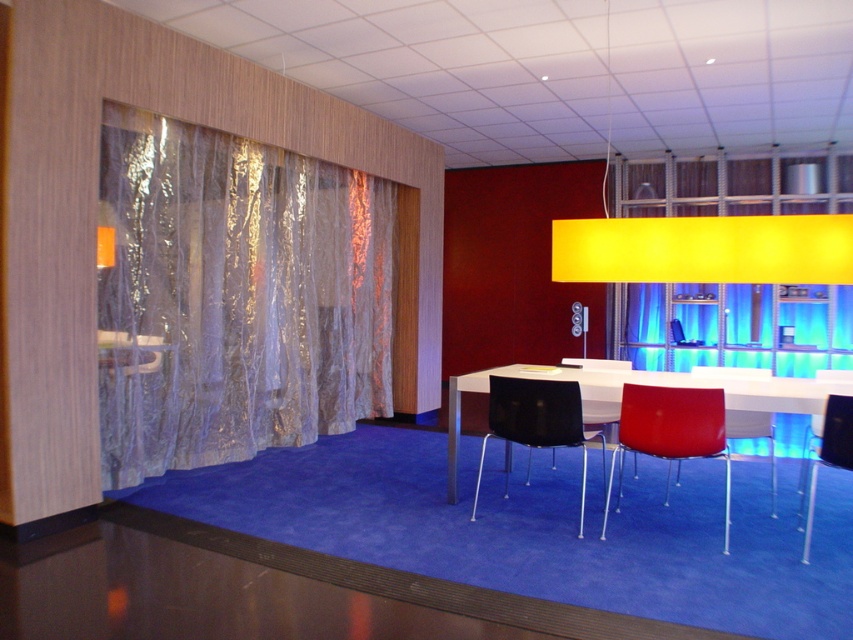
Looking at this image, does translucent metallic curtain at left appear on the left side of glossy plastic chair at lower center?

Yes, translucent metallic curtain at left is to the left of glossy plastic chair at lower center.

Which is above, translucent metallic curtain at left or glossy plastic chair at lower center?

translucent metallic curtain at left is above.

Identify the location of translucent metallic curtain at left. This screenshot has height=640, width=853. (233, 296).

Locate an element on the screen. The width and height of the screenshot is (853, 640). translucent metallic curtain at left is located at coordinates (233, 296).

Is translucent metallic curtain at left positioned at the back of matte black chair at lower right?

Yes, translucent metallic curtain at left is behind matte black chair at lower right.

This screenshot has width=853, height=640. What do you see at coordinates (233, 296) in the screenshot? I see `translucent metallic curtain at left` at bounding box center [233, 296].

The image size is (853, 640). Identify the location of translucent metallic curtain at left. (233, 296).

Between point (666, 445) and point (844, 419), which one is positioned in front?

Point (844, 419) is more forward.

Does glossy plastic chair at lower center lie behind matte black chair at lower right?

Yes, glossy plastic chair at lower center is further from the viewer.

Between point (624, 435) and point (820, 454), which one is positioned behind?

The point (624, 435) is behind.

The image size is (853, 640). In order to click on glossy plastic chair at lower center in this screenshot , I will do `click(671, 432)`.